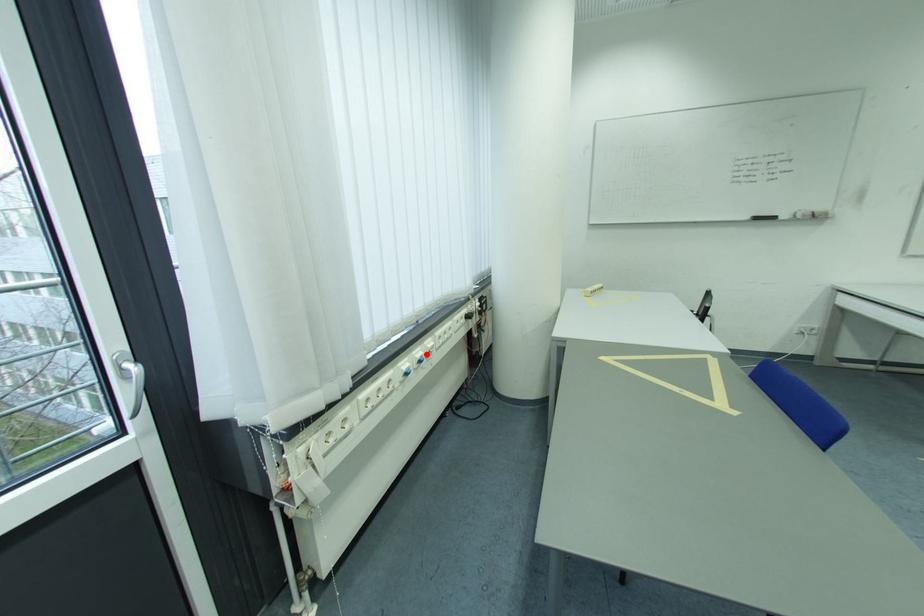
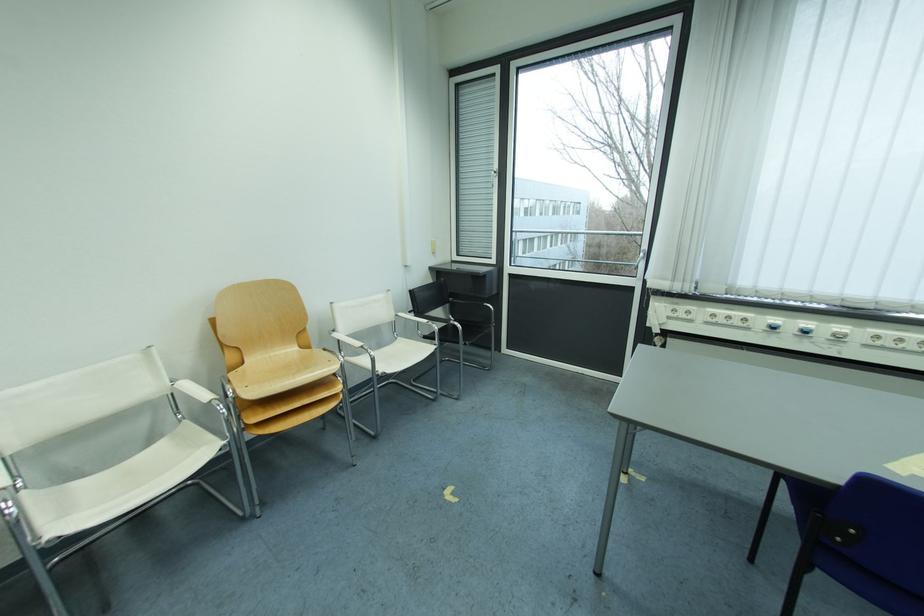
Find the pixel in the second image that matches the highlighted location in the first image.

(816, 326)